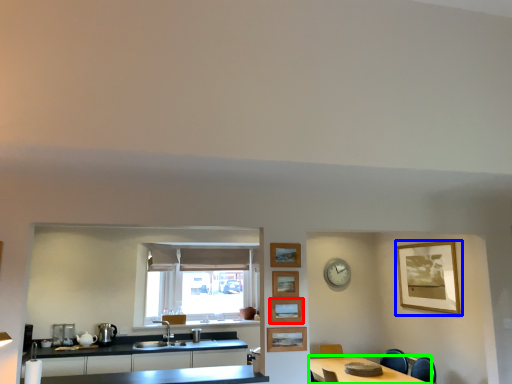
Question: Estimate the real-world distances between objects in this image. Which object is closer to picture frame (highlighted by a red box), picture frame (highlighted by a blue box) or table (highlighted by a green box)?

Choices:
 (A) picture frame
 (B) table

Answer: (B)